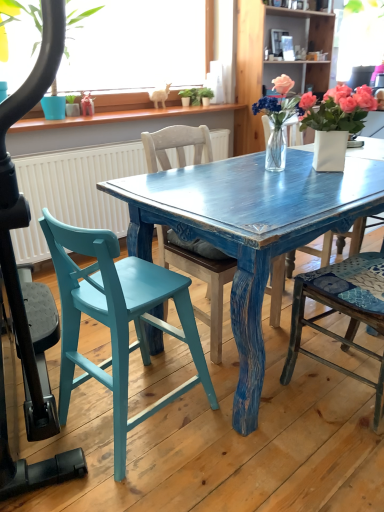
What is the approximate height of white ceramic vase at upper right, the 1th houseplant positioned from the right?

white ceramic vase at upper right, the 1th houseplant positioned from the right, is 12.42 inches tall.

Looking at this image, what is the approximate width of teal painted wood chair at left, positioned as the 1th chair in left-to-right order?

The width of teal painted wood chair at left, positioned as the 1th chair in left-to-right order, is 17.98 inches.

In order to face clear glass vase at center, the second houseplant from the left, should I rotate leftwards or rightwards?

Turn right approximately 11.008 degrees to face it.

What do you see at coordinates (18, 21) in the screenshot? I see `green matte plant at upper left, the first houseplant from the left` at bounding box center [18, 21].

I want to click on white ceramic vase at upper center, so click(273, 63).

What do you see at coordinates (341, 311) in the screenshot? The width and height of the screenshot is (384, 512). I see `wooden chair at right, placed as the first chair when sorted from right to left` at bounding box center [341, 311].

This screenshot has height=512, width=384. What do you see at coordinates (365, 98) in the screenshot?
I see `pink matte flower at upper right` at bounding box center [365, 98].

This screenshot has width=384, height=512. What are the coordinates of `white ceramic vase at upper right, the 3th houseplant from the left` in the screenshot? It's located at (335, 122).

From the image's perspective, would you say white ceramic vase at upper center is shown under pink matte flower at upper right?

Correct, white ceramic vase at upper center appears lower than pink matte flower at upper right in the image.

Considering the positions of points (261, 26) and (366, 99), is point (261, 26) closer to camera compared to point (366, 99)?

No.

This screenshot has height=512, width=384. In order to click on flower below the white ceramic vase at upper center (from a real-world perspective) in this screenshot , I will do `click(365, 98)`.

How many degrees apart are the facing directions of white ceramic vase at upper center and pink matte flower at upper right?

The angle between the facing direction of white ceramic vase at upper center and the facing direction of pink matte flower at upper right is 0.952 degrees.

Are white ceramic vase at upper center and wooden chair at right, the 3th chair when ordered from left to right, located far from each other?

Yes, white ceramic vase at upper center is far from wooden chair at right, the 3th chair when ordered from left to right.

From the image's perspective, is white ceramic vase at upper center above or below wooden chair at right, the 3th chair when ordered from left to right?

white ceramic vase at upper center is situated higher than wooden chair at right, the 3th chair when ordered from left to right, in the image.

Does white ceramic vase at upper center have a larger size compared to wooden chair at right, placed as the first chair when sorted from right to left?

Yes, white ceramic vase at upper center is bigger than wooden chair at right, placed as the first chair when sorted from right to left.

Considering the sizes of objects white ceramic vase at upper center and wooden chair at right, placed as the first chair when sorted from right to left, in the image provided, who is taller, white ceramic vase at upper center or wooden chair at right, placed as the first chair when sorted from right to left,?

white ceramic vase at upper center is taller.

Is wooden chair at center, arranged as the 2th chair when viewed from the right, positioned in front of green matte plant at upper left, the first houseplant from the left?

Yes, wooden chair at center, arranged as the 2th chair when viewed from the right, is closer to the viewer.

Does wooden chair at center, arranged as the 2th chair when viewed from the right, have a lesser height compared to green matte plant at upper left, the first houseplant from the left?

No, wooden chair at center, arranged as the 2th chair when viewed from the right, is not shorter than green matte plant at upper left, the first houseplant from the left.

Can you tell me how much wooden chair at center, which appears as the second chair when viewed from the left, and green matte plant at upper left, the third houseplant in the right-to-left sequence, differ in facing direction?

There is a 1.76-degree angle between the facing directions of wooden chair at center, which appears as the second chair when viewed from the left, and green matte plant at upper left, the third houseplant in the right-to-left sequence.

From the image's perspective, is wooden chair at center, arranged as the 2th chair when viewed from the right, over green matte plant at upper left, the third houseplant in the right-to-left sequence?

Actually, wooden chair at center, arranged as the 2th chair when viewed from the right, appears below green matte plant at upper left, the third houseplant in the right-to-left sequence, in the image.

Is the position of white ceramic vase at upper center more distant than that of wooden chair at center, which appears as the second chair when viewed from the left?

A: Yes, it is.

Considering the relative sizes of white ceramic vase at upper center and wooden chair at center, which appears as the second chair when viewed from the left, in the image provided, is white ceramic vase at upper center thinner than wooden chair at center, which appears as the second chair when viewed from the left,?

Correct, the width of white ceramic vase at upper center is less than that of wooden chair at center, which appears as the second chair when viewed from the left.

From the image's perspective, is white ceramic vase at upper center positioned above or below wooden chair at center, which appears as the second chair when viewed from the left?

From the image's perspective, white ceramic vase at upper center appears above wooden chair at center, which appears as the second chair when viewed from the left.

Which is closer, [250,53] or [210,352]?

A: The point [210,352] is in front.

Consider the image. Is white ceramic vase at upper right, the 3th houseplant from the left, surrounded by pink matte flower at upper right?

No, white ceramic vase at upper right, the 3th houseplant from the left, is not inside pink matte flower at upper right.

How many degrees apart are the facing directions of pink matte flower at upper right and white ceramic vase at upper right, the 1th houseplant positioned from the right?

There is a 40.2-degree angle between the facing directions of pink matte flower at upper right and white ceramic vase at upper right, the 1th houseplant positioned from the right.

Which of these two, pink matte flower at upper right or white ceramic vase at upper right, the 3th houseplant from the left, is thinner?

With smaller width is pink matte flower at upper right.

Is point (366, 91) closer or farther from the camera than point (329, 90)?

Point (366, 91) appears to be closer to the viewer than point (329, 90).

From the image's perspective, would you say white ceramic vase at upper center is positioned over white ceramic vase at upper right, the 1th houseplant positioned from the right?

Yes.

From a real-world perspective, between white ceramic vase at upper center and white ceramic vase at upper right, the 3th houseplant from the left, who is vertically lower?

In real-world perspective, white ceramic vase at upper right, the 3th houseplant from the left, is lower.

Is white ceramic vase at upper center next to white ceramic vase at upper right, the 1th houseplant positioned from the right?

No, white ceramic vase at upper center is not with white ceramic vase at upper right, the 1th houseplant positioned from the right.

Looking at the image, does white ceramic vase at upper center seem bigger or smaller compared to white ceramic vase at upper right, the 1th houseplant positioned from the right?

Clearly, white ceramic vase at upper center is larger in size than white ceramic vase at upper right, the 1th houseplant positioned from the right.

At what (x,y) coordinates should I click in order to perform the action: click on houseplant located on the left of teal painted wood chair at left, which is counted as the third chair, starting from the right. Please return your answer as a coordinate pair (x, y). The width and height of the screenshot is (384, 512). Looking at the image, I should click on (18, 21).

In terms of size, does teal painted wood chair at left, which is counted as the third chair, starting from the right, appear bigger or smaller than green matte plant at upper left, the third houseplant in the right-to-left sequence?

In the image, teal painted wood chair at left, which is counted as the third chair, starting from the right, appears to be smaller than green matte plant at upper left, the third houseplant in the right-to-left sequence.

Based on the photo, would you say teal painted wood chair at left, which is counted as the third chair, starting from the right, is outside green matte plant at upper left, the first houseplant from the left?

Yes, teal painted wood chair at left, which is counted as the third chair, starting from the right, is not within green matte plant at upper left, the first houseplant from the left.

Considering the points (165, 270) and (0, 32), which point is behind, point (165, 270) or point (0, 32)?

The point (0, 32) is more distant.

In order to click on bookshelf that appears above the pink matte flower at upper right (from a real-world perspective) in this screenshot , I will do `click(273, 63)`.

There is a white ceramic vase at upper center. At what (x,y) coordinates should I click in order to perform the action: click on the 2nd chair below it (from the image's perspective). Please return your answer as a coordinate pair (x, y). The height and width of the screenshot is (512, 384). Looking at the image, I should click on (341, 311).

Based on their spatial positions, is green matte plant at upper left, the first houseplant from the left, or white ceramic vase at upper right, the 1th houseplant positioned from the right, closer to wooden chair at center, arranged as the 2th chair when viewed from the right?

The object closer to wooden chair at center, arranged as the 2th chair when viewed from the right, is white ceramic vase at upper right, the 1th houseplant positioned from the right.

Looking at this image, when comparing their distances from white ceramic vase at upper right, the 3th houseplant from the left, does teal painted wood chair at left, which is counted as the third chair, starting from the right, or pink matte flower at upper right seem further?

teal painted wood chair at left, which is counted as the third chair, starting from the right, lies further to white ceramic vase at upper right, the 3th houseplant from the left, than the other object.

When comparing their distances from teal painted wood chair at left, positioned as the 1th chair in left-to-right order, does clear glass vase at center, the second houseplant in the right-to-left sequence, or white ceramic vase at upper center seem further?

The object further to teal painted wood chair at left, positioned as the 1th chair in left-to-right order, is white ceramic vase at upper center.

Looking at the image, which one is located closer to green matte plant at upper left, the third houseplant in the right-to-left sequence, wooden chair at center, which appears as the second chair when viewed from the left, or wooden chair at right, the 3th chair when ordered from left to right?

wooden chair at center, which appears as the second chair when viewed from the left, lies closer to green matte plant at upper left, the third houseplant in the right-to-left sequence, than the other object.

When comparing their distances from white ceramic vase at upper center, does white ceramic vase at upper right, the 1th houseplant positioned from the right, or green matte plant at upper left, the first houseplant from the left, seem closer?

green matte plant at upper left, the first houseplant from the left, is positioned closer to the anchor white ceramic vase at upper center.

Estimate the real-world distances between objects in this image. Which object is closer to clear glass vase at center, the second houseplant in the right-to-left sequence, teal painted wood chair at left, positioned as the 1th chair in left-to-right order, or wooden chair at center, which appears as the second chair when viewed from the left?

Based on the image, wooden chair at center, which appears as the second chair when viewed from the left, appears to be nearer to clear glass vase at center, the second houseplant in the right-to-left sequence.

Based on their spatial positions, is white ceramic vase at upper center or teal painted wood chair at left, positioned as the 1th chair in left-to-right order, further from clear glass vase at center, the second houseplant in the right-to-left sequence?

Based on the image, white ceramic vase at upper center appears to be further to clear glass vase at center, the second houseplant in the right-to-left sequence.

Based on their spatial positions, is pink matte flower at upper right or teal painted wood chair at left, which is counted as the third chair, starting from the right, closer to wooden chair at center, arranged as the 2th chair when viewed from the right?

The object closer to wooden chair at center, arranged as the 2th chair when viewed from the right, is teal painted wood chair at left, which is counted as the third chair, starting from the right.

Where is `bookshelf between clear glass vase at center, the second houseplant from the left, and pink matte flower at upper right, along the z-axis`? bookshelf between clear glass vase at center, the second houseplant from the left, and pink matte flower at upper right, along the z-axis is located at coordinates (273, 63).

Locate an element on the screen. Image resolution: width=384 pixels, height=512 pixels. chair located between teal painted wood chair at left, which is counted as the third chair, starting from the right, and white ceramic vase at upper right, the 1th houseplant positioned from the right, in the left-right direction is located at coordinates (200, 277).

Find the location of a particular element. The image size is (384, 512). bookshelf between teal painted wood chair at left, positioned as the 1th chair in left-to-right order, and pink matte flower at upper right in the front-back direction is located at coordinates pos(273,63).

Image resolution: width=384 pixels, height=512 pixels. What are the coordinates of `houseplant between green matte plant at upper left, the first houseplant from the left, and white ceramic vase at upper right, the 1th houseplant positioned from the right, from left to right` in the screenshot? It's located at (277, 120).